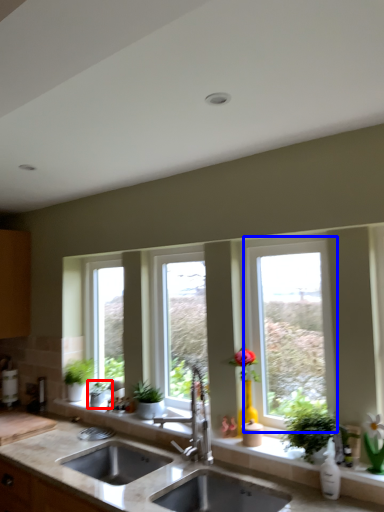
Question: Which object is further to the camera taking this photo, houseplant (highlighted by a red box) or window (highlighted by a blue box)?

Choices:
 (A) houseplant
 (B) window

Answer: (A)